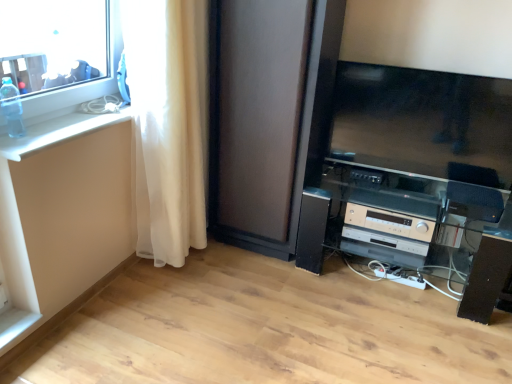
The width and height of the screenshot is (512, 384). What are the coordinates of `blank space to the left of satin black entertainment center at lower right` in the screenshot? It's located at (260, 301).